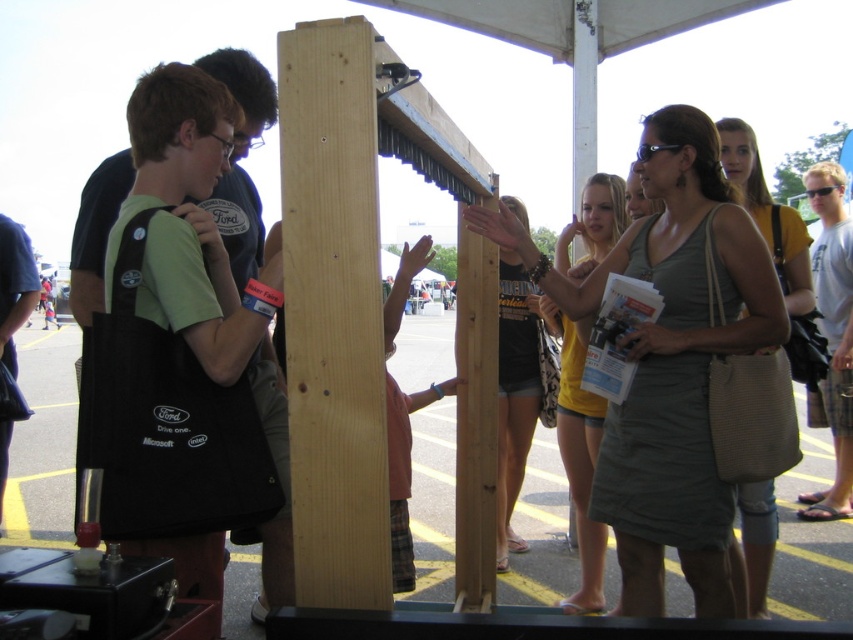
Who is lower down, black fabric bag at left or black plastic goggles at upper center?

black fabric bag at left is lower down.

Can you confirm if black fabric bag at left is taller than black plastic goggles at upper center?

Yes.

The width and height of the screenshot is (853, 640). I want to click on black fabric bag at left, so (x=225, y=352).

Between black fabric bag at left and dark blue shirt at left, which one appears on the left side from the viewer's perspective?

dark blue shirt at left

Between black fabric bag at left and dark blue shirt at left, which one is positioned higher?

dark blue shirt at left is higher up.

What do you see at coordinates (225, 352) in the screenshot?
I see `black fabric bag at left` at bounding box center [225, 352].

In order to click on black fabric bag at left in this screenshot , I will do `click(225, 352)`.

Does point (816, 209) lie behind point (643, 148)?

Yes, point (816, 209) is behind point (643, 148).

Can you confirm if light blue t-shirt at center is taller than black plastic goggles at upper center?

Correct, light blue t-shirt at center is much taller as black plastic goggles at upper center.

Who is more distant from viewer, [804,502] or [643,145]?

Positioned behind is point [804,502].

You are a GUI agent. You are given a task and a screenshot of the screen. Output one action in this format:
    pyautogui.click(x=<x>, y=<y>)
    Task: Click on the light blue t-shirt at center
    
    Given the screenshot: What is the action you would take?
    pyautogui.click(x=833, y=349)